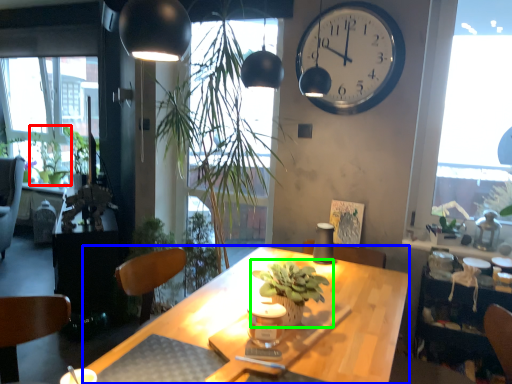
Question: Which is nearer to the plant (highlighted by a red box)? desk (highlighted by a blue box) or houseplant (highlighted by a green box).

Choices:
 (A) desk
 (B) houseplant

Answer: (A)